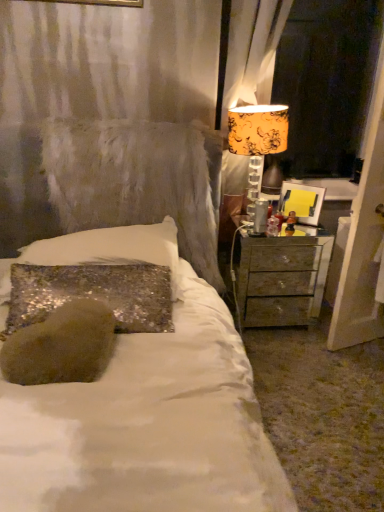
I want to click on vacant space underneath metallic silver nightstand at right (from a real-world perspective), so click(x=265, y=328).